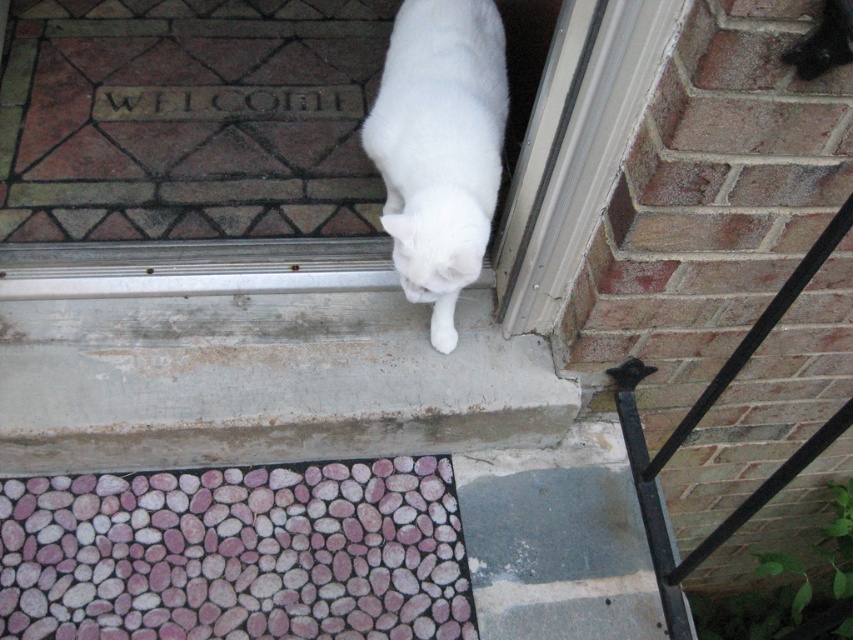
Does pebble-patterned mat at lower left have a greater width compared to white fluffy cat at lower center?

Indeed, pebble-patterned mat at lower left has a greater width compared to white fluffy cat at lower center.

Does pebble-patterned mat at lower left appear on the left side of white fluffy cat at lower center?

Correct, you'll find pebble-patterned mat at lower left to the left of white fluffy cat at lower center.

Who is more distant from viewer, (x=399, y=588) or (x=421, y=294)?

Positioned behind is point (x=399, y=588).

Locate an element on the screen. pebble-patterned mat at lower left is located at coordinates (236, 554).

Who is taller, smooth concrete step at center or white fluffy cat at lower center?

With more height is white fluffy cat at lower center.

Does smooth concrete step at center appear on the left side of white fluffy cat at lower center?

Correct, you'll find smooth concrete step at center to the left of white fluffy cat at lower center.

Measure the distance between smooth concrete step at center and camera.

1.33 meters

The width and height of the screenshot is (853, 640). Find the location of `smooth concrete step at center`. smooth concrete step at center is located at coordinates (256, 372).

Describe the element at coordinates (256, 372) in the screenshot. I see `smooth concrete step at center` at that location.

Looking at this image, measure the distance between point (486, 378) and camera.

Point (486, 378) and camera are 1.47 meters apart.

In order to click on smooth concrete step at center in this screenshot , I will do pyautogui.click(x=256, y=372).